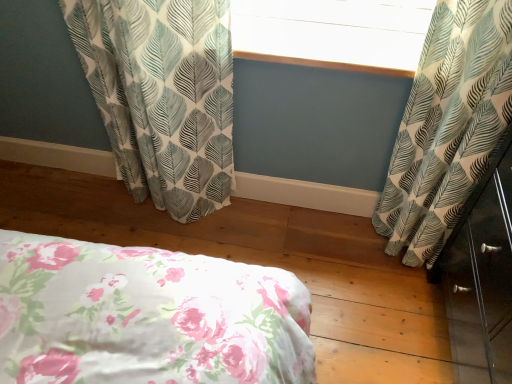
Identify the location of vacant location below white leaf-patterned curtain at right, which ranks as the first curtain in right-to-left order (from a real-world perspective). (373, 241).